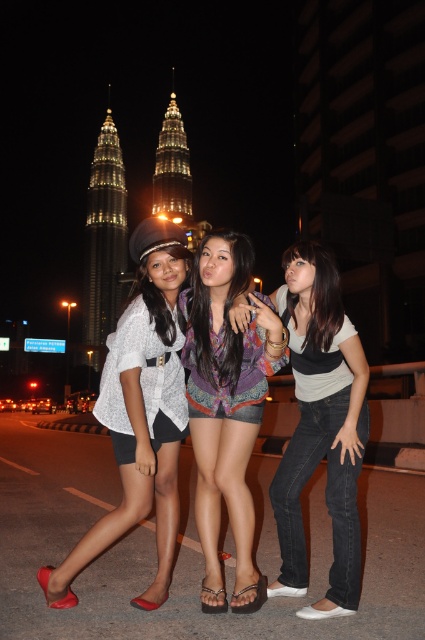
Identify the location of matte white blouse at left. This screenshot has height=640, width=425. (141, 413).

Between point (153, 490) and point (249, 417), which one is positioned behind?

Positioned behind is point (249, 417).

Where is `matte white blouse at left`? The height and width of the screenshot is (640, 425). matte white blouse at left is located at coordinates (141, 413).

Can you confirm if matte white blouse at left is positioned above denim jeans at center?

Correct, matte white blouse at left is located above denim jeans at center.

Is matte white blouse at left in front of denim jeans at center?

No.

Does point (116, 420) come in front of point (303, 362)?

Yes, it is.

At what (x,y) coordinates should I click in order to perform the action: click on matte white blouse at left. Please return your answer as a coordinate pair (x, y). Image resolution: width=425 pixels, height=640 pixels. Looking at the image, I should click on (141, 413).

Is denim jeans at center positioned in front of multicolored woven shirt at center?

That is True.

Who is more distant from viewer, [297,276] or [244,435]?

The point [297,276] is behind.

Who is more forward, (336, 556) or (209, 452)?

Point (336, 556)

The image size is (425, 640). Identify the location of denim jeans at center. (320, 426).